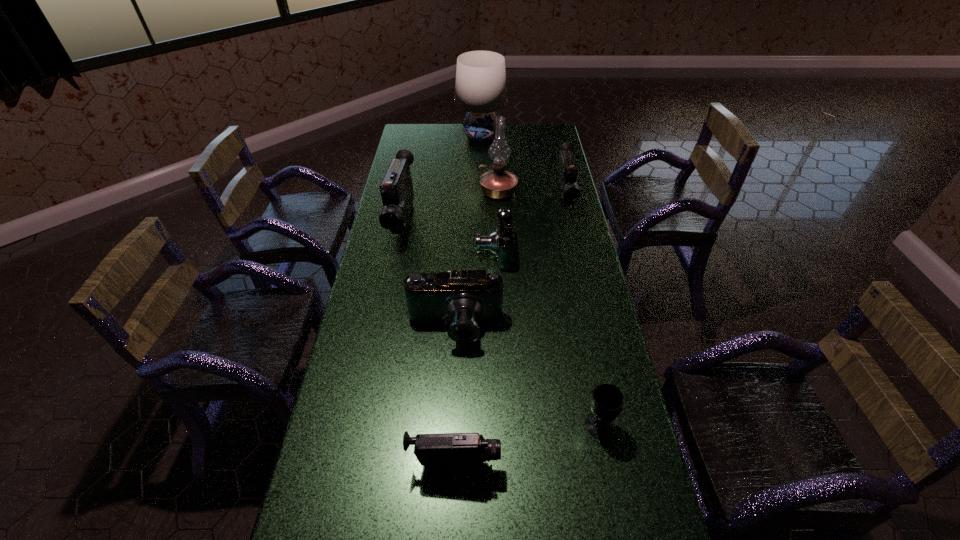
I want to click on the farthest object, so click(480, 89).

At what (x,y) coordinates should I click in order to perform the action: click on blue lampshade. Please return your answer as a coordinate pair (x, y). The width and height of the screenshot is (960, 540). Looking at the image, I should click on (480, 89).

You are a GUI agent. You are given a task and a screenshot of the screen. Output one action in this format:
    pyautogui.click(x=<x>, y=<y>)
    Task: Click on the oil lamp
    
    Given the screenshot: What is the action you would take?
    pyautogui.click(x=497, y=183)

At what (x,y) coordinates should I click in order to perform the action: click on the sixth shortest object. Please return your answer as a coordinate pair (x, y). The image size is (960, 540). Looking at the image, I should click on (396, 188).

Locate an element on the screen. the leftmost camcorder is located at coordinates pyautogui.click(x=396, y=188).

At what (x,y) coordinates should I click in order to perform the action: click on the rightmost camcorder. Please return your answer as a coordinate pair (x, y). Looking at the image, I should click on (567, 174).

You are a GUI agent. You are given a task and a screenshot of the screen. Output one action in this format:
    pyautogui.click(x=<x>, y=<y>)
    Task: Click on the rightmost black camcorder
    
    Given the screenshot: What is the action you would take?
    coord(567,174)

Identify the location of the sixth farthest object. The width and height of the screenshot is (960, 540). (463, 299).

Where is `the nearer blue camcorder`? This screenshot has height=540, width=960. the nearer blue camcorder is located at coordinates (463, 299).

This screenshot has height=540, width=960. What are the coordinates of `the smallest black camcorder` in the screenshot? It's located at (464, 450).